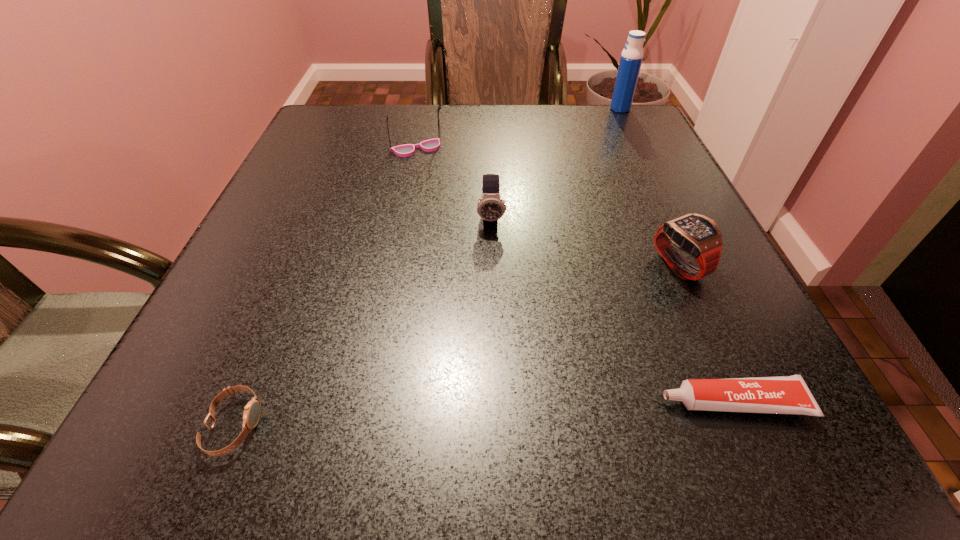
Where is `free location that satisfies the following two spatial constraints: 1. on the front side of the fourth farthest object; 2. at the nozzle of the toothpaste`? The image size is (960, 540). free location that satisfies the following two spatial constraints: 1. on the front side of the fourth farthest object; 2. at the nozzle of the toothpaste is located at coordinates (740, 402).